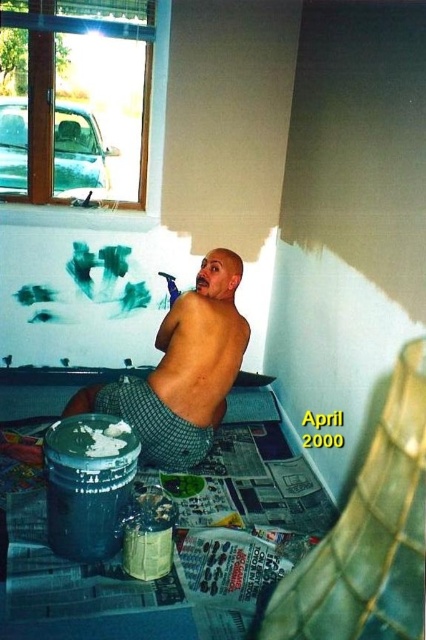
Is shiny metallic paint can at lower left thinner than muscular tan skin at back?

No, shiny metallic paint can at lower left is not thinner than muscular tan skin at back.

Does shiny metallic paint can at lower left have a greater height compared to muscular tan skin at back?

Correct, shiny metallic paint can at lower left is much taller as muscular tan skin at back.

What do you see at coordinates (183, 371) in the screenshot? I see `shiny metallic paint can at lower left` at bounding box center [183, 371].

What are the coordinates of `shiny metallic paint can at lower left` in the screenshot? It's located at [183, 371].